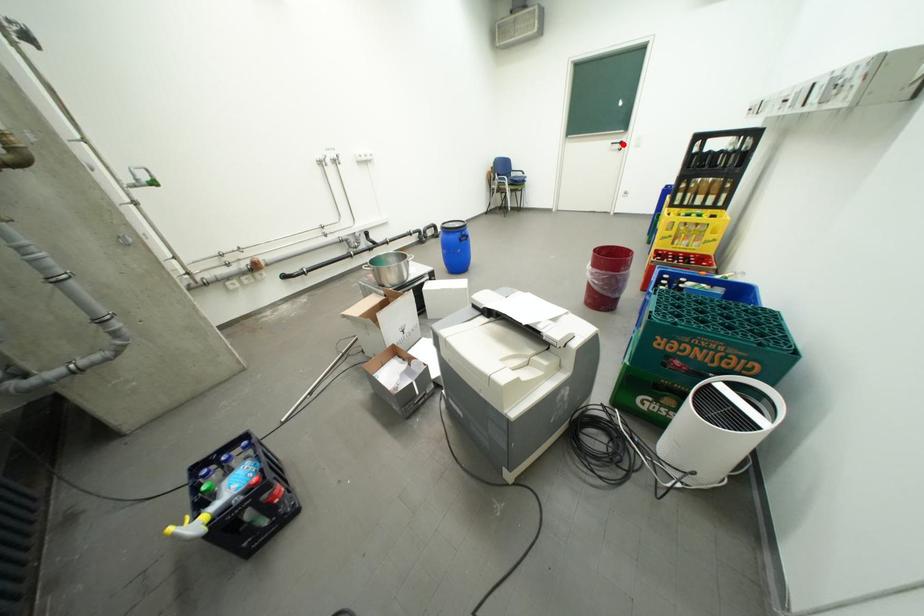
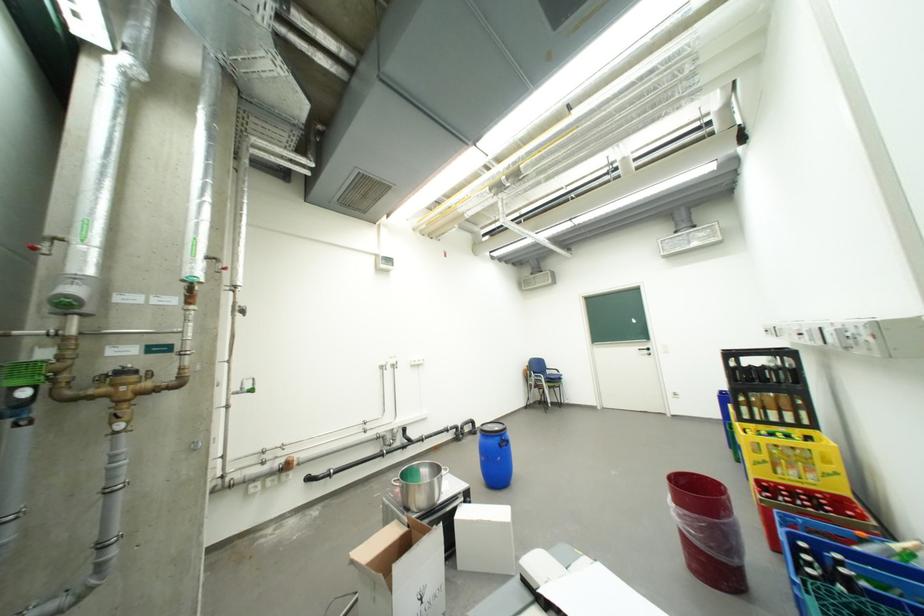
Question: I am providing you with two images of the same scene from different viewpoints. In image1, a red point is highlighted. Considering the same 3D point in image2, which of the following is correct?

Choices:
 (A) It is closer
 (B) It is farther

Answer: (B)